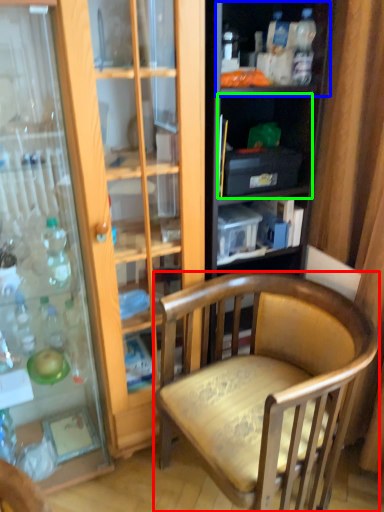
Question: Which object is positioned closest to chair (highlighted by a red box)? Select from shelf (highlighted by a blue box) and shelf (highlighted by a green box).

Choices:
 (A) shelf
 (B) shelf

Answer: (B)